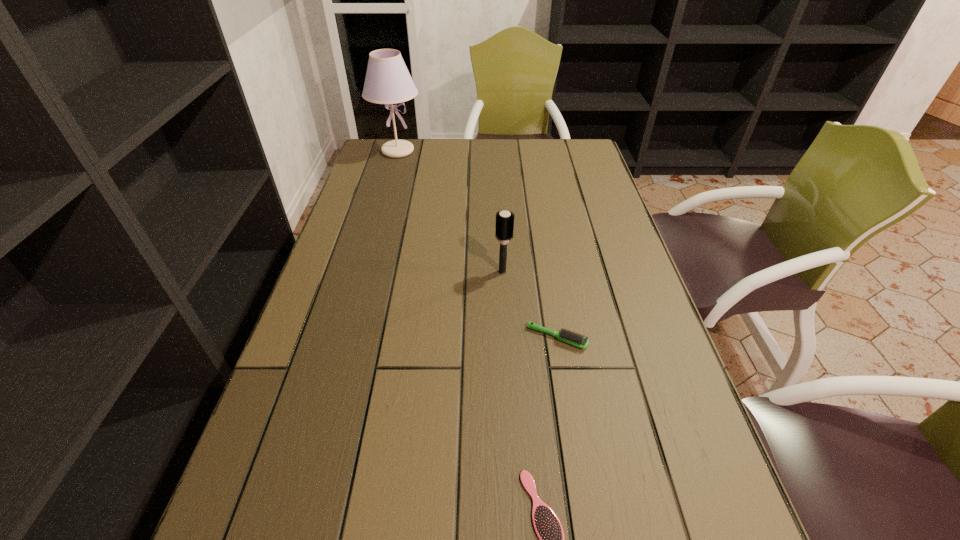
This screenshot has height=540, width=960. I want to click on object that is at the left edge, so click(387, 81).

You are a GUI agent. You are given a task and a screenshot of the screen. Output one action in this format:
    pyautogui.click(x=<x>, y=<y>)
    Task: Click on the object positioned at the far left corner
    This screenshot has width=960, height=540.
    Given the screenshot: What is the action you would take?
    pyautogui.click(x=387, y=81)

In the image, there is a desktop. Identify the location of free space at the far edge. The image size is (960, 540). (432, 167).

Where is `vacant space at the left edge of the desktop`? vacant space at the left edge of the desktop is located at coordinates (357, 387).

The height and width of the screenshot is (540, 960). I want to click on free space at the right edge, so click(x=631, y=436).

This screenshot has height=540, width=960. What are the coordinates of `free space at the far left corner of the desktop` in the screenshot? It's located at (377, 152).

The height and width of the screenshot is (540, 960). I want to click on vacant area at the far right corner, so click(564, 162).

Identify the location of vacant space that's between the third shortest object and the tallest object. (450, 211).

Find the location of a particular element. free space between the second shortest hairbrush and the farthest hairbrush is located at coordinates 530,305.

Image resolution: width=960 pixels, height=540 pixels. I want to click on free point between the second tallest hairbrush and the third nearest object, so click(x=530, y=305).